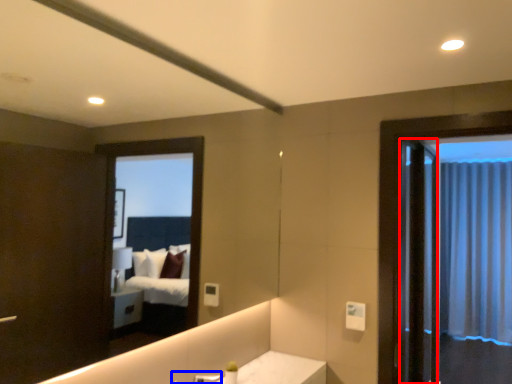
Question: Among these objects, which one is nearest to the camera, screen door (highlighted by a red box) or faucet (highlighted by a blue box)?

Choices:
 (A) screen door
 (B) faucet

Answer: (B)